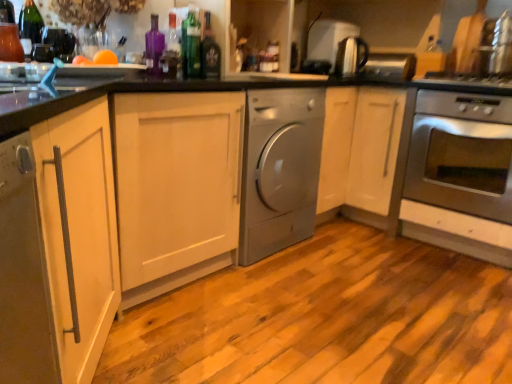
The width and height of the screenshot is (512, 384). What do you see at coordinates (336, 47) in the screenshot? I see `satin silver toaster at upper center, which is counted as the 1th appliance, starting from the back` at bounding box center [336, 47].

Locate an element on the screen. Image resolution: width=512 pixels, height=384 pixels. satin silver toaster at upper center, the second appliance viewed from the front is located at coordinates (336, 47).

Measure the distance between point (268, 178) and camera.

Point (268, 178) and camera are 6.48 feet apart from each other.

Describe the element at coordinates (210, 52) in the screenshot. This screenshot has width=512, height=384. I see `shiny dark glass bottle at center, which is counted as the 4th bottle, starting from the left` at that location.

This screenshot has height=384, width=512. In order to click on purple glass bottle at upper center, the 3th bottle when ordered from right to left in this screenshot , I will do `click(154, 46)`.

In order to face satin silver kettle at upper right, the first appliance when ordered from front to back, should I rotate leftwards or rightwards?

Rotate right and turn 12.524 degrees.

Find the location of a particular element. This screenshot has height=384, width=512. stainless steel oven at right is located at coordinates (462, 154).

Which is more to the right, stainless steel oven at right or shiny dark glass bottle at center, which is counted as the 4th bottle, starting from the left?

From the viewer's perspective, stainless steel oven at right appears more on the right side.

In the image, is stainless steel oven at right positioned in front of or behind shiny dark glass bottle at center, marked as the 1th bottle in a right-to-left arrangement?

stainless steel oven at right is positioned closer to the viewer than shiny dark glass bottle at center, marked as the 1th bottle in a right-to-left arrangement.

Is stainless steel oven at right outside of shiny dark glass bottle at center, which is counted as the 4th bottle, starting from the left?

stainless steel oven at right lies outside shiny dark glass bottle at center, which is counted as the 4th bottle, starting from the left,'s area.

Find the location of a particular element. bottle behind the stainless steel oven at right is located at coordinates (210, 52).

Is satin silver kettle at upper right, the second appliance in the back-to-front sequence, to the left or to the right of satin silver toaster at upper center, the second appliance viewed from the front, in the image?

satin silver kettle at upper right, the second appliance in the back-to-front sequence, is to the right of satin silver toaster at upper center, the second appliance viewed from the front.

From a real-world perspective, which object rests below the other?

satin silver kettle at upper right, the first appliance when ordered from front to back.

Can you confirm if satin silver kettle at upper right, the first appliance when ordered from front to back, is smaller than satin silver toaster at upper center, which is counted as the 1th appliance, starting from the back?

Indeed, satin silver kettle at upper right, the first appliance when ordered from front to back, has a smaller size compared to satin silver toaster at upper center, which is counted as the 1th appliance, starting from the back.

From a real-world perspective, does satin silver kettle at upper right, the second appliance in the back-to-front sequence, sit lower than shiny dark glass bottle at center, which is counted as the 4th bottle, starting from the left?

Incorrect, from a real-world perspective, satin silver kettle at upper right, the second appliance in the back-to-front sequence, is higher than shiny dark glass bottle at center, which is counted as the 4th bottle, starting from the left.

Looking at this image, is satin silver kettle at upper right, the first appliance when ordered from front to back, facing away from shiny dark glass bottle at center, which is counted as the 4th bottle, starting from the left?

satin silver kettle at upper right, the first appliance when ordered from front to back, does not have its back to shiny dark glass bottle at center, which is counted as the 4th bottle, starting from the left.

Between satin silver kettle at upper right, the second appliance in the back-to-front sequence, and shiny dark glass bottle at center, which is counted as the 4th bottle, starting from the left, which one has less height?

With less height is satin silver kettle at upper right, the second appliance in the back-to-front sequence.

Would you say green glass bottle at upper center, which is the 2th bottle in right-to-left order, is part of matte glass bottle at upper left, arranged as the first bottle when viewed from the left,'s contents?

Actually, green glass bottle at upper center, which is the 2th bottle in right-to-left order, is outside matte glass bottle at upper left, arranged as the first bottle when viewed from the left.

Looking at this image, who is smaller, matte glass bottle at upper left, arranged as the first bottle when viewed from the left, or green glass bottle at upper center, which is the 2th bottle in right-to-left order?

Smaller between the two is green glass bottle at upper center, which is the 2th bottle in right-to-left order.

In the scene shown: Which point is more distant from viewer, (38, 16) or (191, 26)?

Point (191, 26)

Could you measure the distance between matte glass bottle at upper left, arranged as the first bottle when viewed from the left, and green glass bottle at upper center, which is the 2th bottle in right-to-left order?

matte glass bottle at upper left, arranged as the first bottle when viewed from the left, is 25.16 inches from green glass bottle at upper center, which is the 2th bottle in right-to-left order.

What's the angular difference between purple glass bottle at upper center, the second bottle positioned from the left, and green glass bottle at upper center, which is the 2th bottle in right-to-left order,'s facing directions?

The angle between the facing direction of purple glass bottle at upper center, the second bottle positioned from the left, and the facing direction of green glass bottle at upper center, which is the 2th bottle in right-to-left order, is 13.9 degrees.

From their relative heights in the image, would you say purple glass bottle at upper center, the 3th bottle when ordered from right to left, is taller or shorter than green glass bottle at upper center, which is the 2th bottle in right-to-left order?

In the image, purple glass bottle at upper center, the 3th bottle when ordered from right to left, appears to be shorter than green glass bottle at upper center, which is the 2th bottle in right-to-left order.

Which object is positioned more to the left, purple glass bottle at upper center, the 3th bottle when ordered from right to left, or green glass bottle at upper center, which is the 2th bottle in right-to-left order?

Positioned to the left is purple glass bottle at upper center, the 3th bottle when ordered from right to left.

From a real-world perspective, which object rests below the other?

In real-world perspective, purple glass bottle at upper center, the 3th bottle when ordered from right to left, is lower.

Can you confirm if satin silver toaster at upper center, the second appliance viewed from the front, is thinner than green glass bottle at upper center, which is the 2th bottle in right-to-left order?

No, satin silver toaster at upper center, the second appliance viewed from the front, is not thinner than green glass bottle at upper center, which is the 2th bottle in right-to-left order.

Is there a large distance between satin silver toaster at upper center, which is counted as the 1th appliance, starting from the back, and green glass bottle at upper center, which is the 2th bottle in right-to-left order?

satin silver toaster at upper center, which is counted as the 1th appliance, starting from the back, is far away from green glass bottle at upper center, which is the 2th bottle in right-to-left order.

Can you tell me how much satin silver toaster at upper center, which is counted as the 1th appliance, starting from the back, and green glass bottle at upper center, which is the third bottle in left-to-right order, differ in facing direction?

satin silver toaster at upper center, which is counted as the 1th appliance, starting from the back, and green glass bottle at upper center, which is the third bottle in left-to-right order, are facing 5.07 degrees away from each other.

Is satin silver toaster at upper center, which is counted as the 1th appliance, starting from the back, bigger or smaller than green glass bottle at upper center, which is the 2th bottle in right-to-left order?

Considering their sizes, satin silver toaster at upper center, which is counted as the 1th appliance, starting from the back, takes up more space than green glass bottle at upper center, which is the 2th bottle in right-to-left order.

Relative to purple glass bottle at upper center, the second bottle positioned from the left, is satin silver dryer at center in front or behind?

Visually, satin silver dryer at center is located behind purple glass bottle at upper center, the second bottle positioned from the left.

Is point (240, 216) farther from viewer compared to point (148, 65)?

Yes.

Looking at this image, does satin silver dryer at center appear on the right side of purple glass bottle at upper center, the 3th bottle when ordered from right to left?

Correct, you'll find satin silver dryer at center to the right of purple glass bottle at upper center, the 3th bottle when ordered from right to left.

From a real-world perspective, is satin silver dryer at center positioned under purple glass bottle at upper center, the second bottle positioned from the left, based on gravity?

Yes, from a real-world perspective, satin silver dryer at center is beneath purple glass bottle at upper center, the second bottle positioned from the left.

Find the location of a particular element. The height and width of the screenshot is (384, 512). oven that is on the right side of shiny dark glass bottle at center, which is counted as the 4th bottle, starting from the left is located at coordinates (462, 154).

Image resolution: width=512 pixels, height=384 pixels. Identify the location of appliance lying in front of the satin silver toaster at upper center, the second appliance viewed from the front. (351, 56).

Which object lies further to the anchor point purple glass bottle at upper center, the second bottle positioned from the left, matte glass bottle at upper left, arranged as the first bottle when viewed from the left, or stainless steel oven at right?

Based on the image, stainless steel oven at right appears to be further to purple glass bottle at upper center, the second bottle positioned from the left.

Considering their positions, is stainless steel oven at right positioned further to satin silver kettle at upper right, the first appliance when ordered from front to back, than purple glass bottle at upper center, the 3th bottle when ordered from right to left?

purple glass bottle at upper center, the 3th bottle when ordered from right to left, lies further to satin silver kettle at upper right, the first appliance when ordered from front to back, than the other object.

Looking at this image, which object lies further to the anchor point shiny dark glass bottle at center, which is counted as the 4th bottle, starting from the left, satin silver kettle at upper right, the second appliance in the back-to-front sequence, or satin silver toaster at upper center, the second appliance viewed from the front?

satin silver toaster at upper center, the second appliance viewed from the front, lies further to shiny dark glass bottle at center, which is counted as the 4th bottle, starting from the left, than the other object.

Estimate the real-world distances between objects in this image. Which object is closer to satin silver toaster at upper center, which is counted as the 1th appliance, starting from the back, satin silver dryer at center or purple glass bottle at upper center, the second bottle positioned from the left?

satin silver dryer at center is positioned closer to the anchor satin silver toaster at upper center, which is counted as the 1th appliance, starting from the back.

Looking at the image, which one is located further to satin silver dryer at center, satin silver kettle at upper right, the second appliance in the back-to-front sequence, or purple glass bottle at upper center, the second bottle positioned from the left?

satin silver kettle at upper right, the second appliance in the back-to-front sequence, is positioned further to the anchor satin silver dryer at center.

From the image, which object appears to be nearer to matte glass bottle at upper left, which is counted as the fourth bottle, starting from the right, stainless steel oven at right or satin silver dryer at center?

The object closer to matte glass bottle at upper left, which is counted as the fourth bottle, starting from the right, is satin silver dryer at center.

Considering their positions, is stainless steel oven at right positioned further to purple glass bottle at upper center, the second bottle positioned from the left, than satin silver toaster at upper center, the second appliance viewed from the front?

stainless steel oven at right lies further to purple glass bottle at upper center, the second bottle positioned from the left, than the other object.

Considering their positions, is satin silver kettle at upper right, the second appliance in the back-to-front sequence, positioned further to stainless steel oven at right than purple glass bottle at upper center, the second bottle positioned from the left?

The object further to stainless steel oven at right is purple glass bottle at upper center, the second bottle positioned from the left.

Find the location of a particular element. bottle between green glass bottle at upper center, which is the 2th bottle in right-to-left order, and stainless steel oven at right is located at coordinates (210, 52).

In order to click on appliance between matte glass bottle at upper left, which is counted as the fourth bottle, starting from the right, and satin silver kettle at upper right, the first appliance when ordered from front to back, from left to right in this screenshot , I will do `click(336, 47)`.

Where is `appliance between satin silver toaster at upper center, the second appliance viewed from the front, and stainless steel oven at right, in the vertical direction`? The height and width of the screenshot is (384, 512). appliance between satin silver toaster at upper center, the second appliance viewed from the front, and stainless steel oven at right, in the vertical direction is located at coordinates (351, 56).

You are a GUI agent. You are given a task and a screenshot of the screen. Output one action in this format:
    pyautogui.click(x=<x>, y=<y>)
    Task: Click on the bottle located between green glass bottle at upper center, which is the 2th bottle in right-to-left order, and satin silver toaster at upper center, the second appliance viewed from the front, in the depth direction
    The image size is (512, 384).
    Given the screenshot: What is the action you would take?
    pyautogui.click(x=210, y=52)